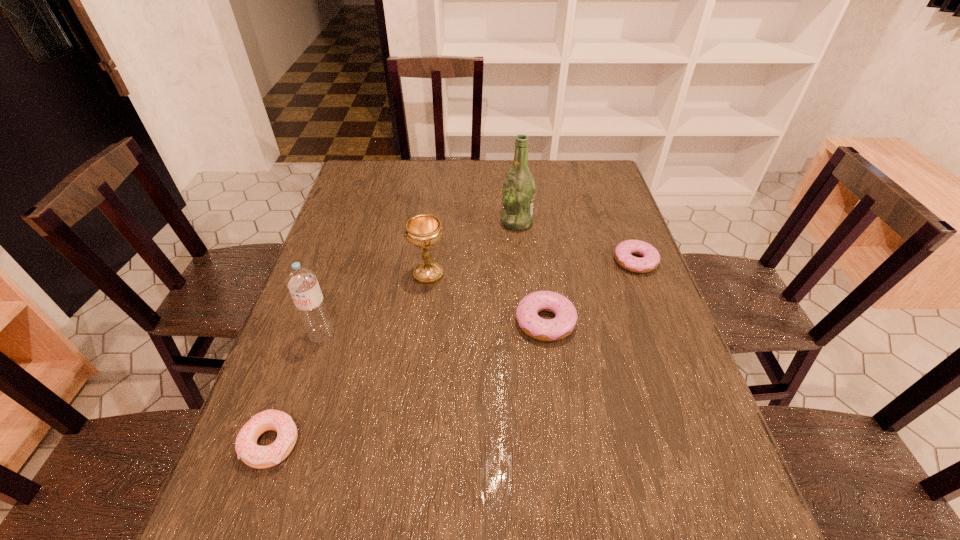
What are the coordinates of `vacant region that satisfies the following two spatial constraints: 1. on the surface of the tallest object; 2. on the front side of the fourth object from right to left` in the screenshot? It's located at (522, 274).

The width and height of the screenshot is (960, 540). Identify the location of free space that satisfies the following two spatial constraints: 1. on the back side of the leftmost doughnut; 2. on the left side of the fourth object from right to left. (330, 274).

This screenshot has height=540, width=960. I want to click on blank space that satisfies the following two spatial constraints: 1. on the back side of the third object from left to right; 2. on the right side of the rightmost object, so click(430, 261).